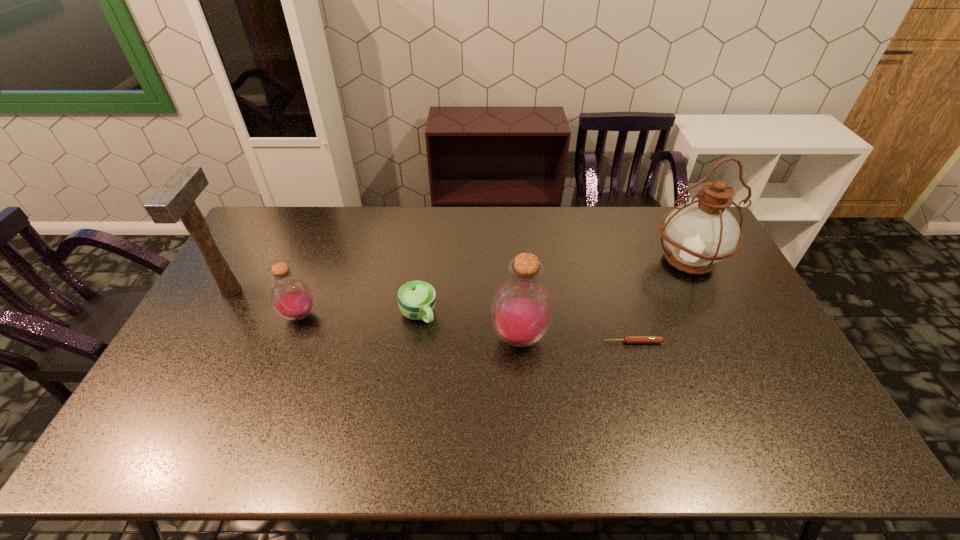
Identify the location of free space between the second shortest object and the oil lamp. (553, 287).

I want to click on free space between the shorter bottle and the right bottle, so click(409, 326).

Locate an element on the screen. The width and height of the screenshot is (960, 540). free space that is in between the taller bottle and the rightmost object is located at coordinates (604, 299).

Locate an element on the screen. Image resolution: width=960 pixels, height=540 pixels. free spot between the oil lamp and the left bottle is located at coordinates click(x=493, y=288).

The width and height of the screenshot is (960, 540). Find the location of `free space between the leftmost object and the fifth object from right to left`. free space between the leftmost object and the fifth object from right to left is located at coordinates (265, 303).

Where is `the closest object to the fourth object from left to right`? This screenshot has width=960, height=540. the closest object to the fourth object from left to right is located at coordinates (627, 339).

Choose which object is the third nearest neighbor to the leftmost object. Please provide its 2D coordinates. Your answer should be formatted as a tuple, i.e. [(x, y)], where the tuple contains the x and y coordinates of a point satisfying the conditions above.

[(521, 312)]

Locate an element on the screen. vacant space that satisfies the following two spatial constraints: 1. on the back side of the mallet; 2. on the right side of the rightmost object is located at coordinates (249, 260).

Where is `free space that satisfies the following two spatial constraints: 1. on the back side of the left bottle; 2. on the left side of the oil lamp`? The height and width of the screenshot is (540, 960). free space that satisfies the following two spatial constraints: 1. on the back side of the left bottle; 2. on the left side of the oil lamp is located at coordinates (321, 260).

Where is `vacant space that satisfies the following two spatial constraints: 1. on the back side of the fifth tallest object; 2. on the right side of the rightmost object`? This screenshot has width=960, height=540. vacant space that satisfies the following two spatial constraints: 1. on the back side of the fifth tallest object; 2. on the right side of the rightmost object is located at coordinates (425, 260).